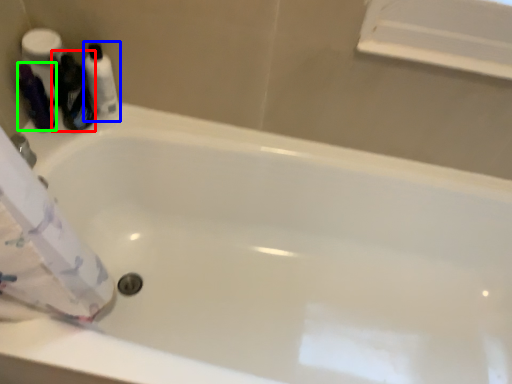
Question: Estimate the real-world distances between objects in this image. Which object is farther from cleaning product (highlighted by a red box), toiletry (highlighted by a blue box) or toiletry (highlighted by a green box)?

Choices:
 (A) toiletry
 (B) toiletry

Answer: (B)